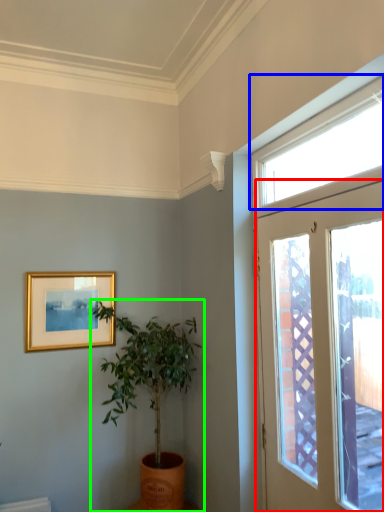
Question: Based on their relative distances, which object is farther from door (highlighted by a red box)? Choose from window (highlighted by a blue box) and houseplant (highlighted by a green box).

Choices:
 (A) window
 (B) houseplant

Answer: (B)